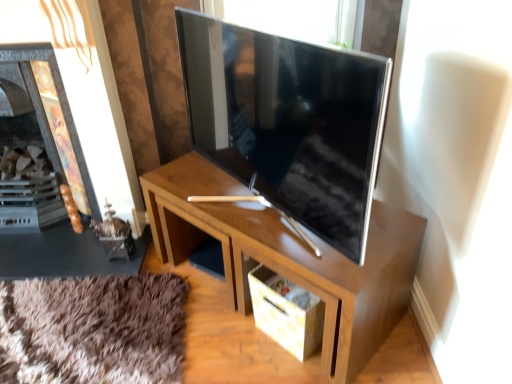
The image size is (512, 384). Identify the location of vacant space that is to the left of matte cardboard drawer at lower center. (228, 340).